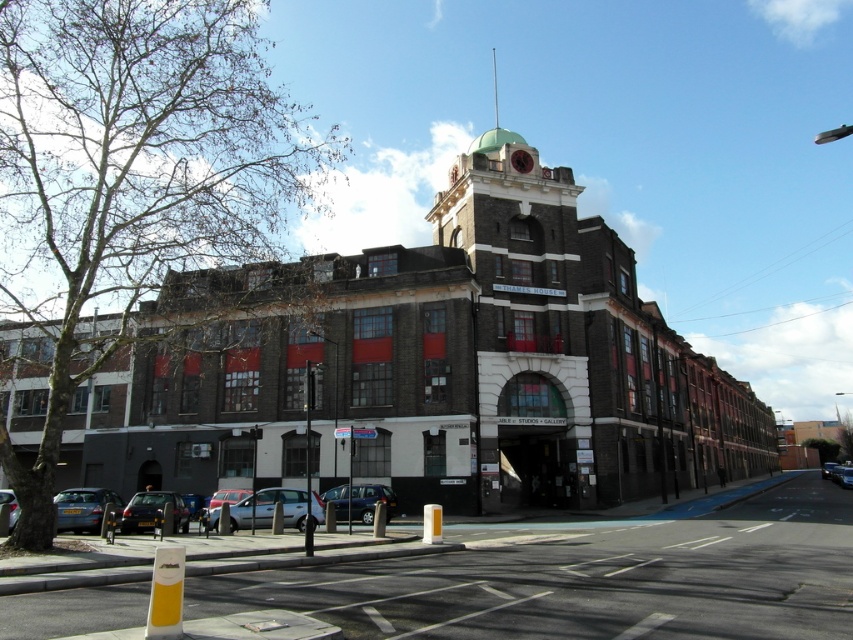
You are standing at the entrance of the building and want to park your car in the street. The parking spot you want is marked by the point at coordinate (270,508). What color is the car currently parked at that spot?

The point at coordinate (270,508) corresponds to a silver metallic car at center, so the car currently parked there is silver metallic.

You are standing on the street in front of the building and want to walk towards the building. Which of the two points, point (289, 497) or point (108, 492), will you reach first?

You will reach point (108, 492) first because it is closer to you than point (289, 497), which is further away.

You are standing on the sidewalk in front of the building and want to cross the street to reach the silver metallic car at center. Is the metallic blue car at lower left blocking your path?

The silver metallic car at center is closer to you than the metallic blue car at lower left, so the metallic blue car at lower left is behind the silver metallic car at center and not blocking your path.